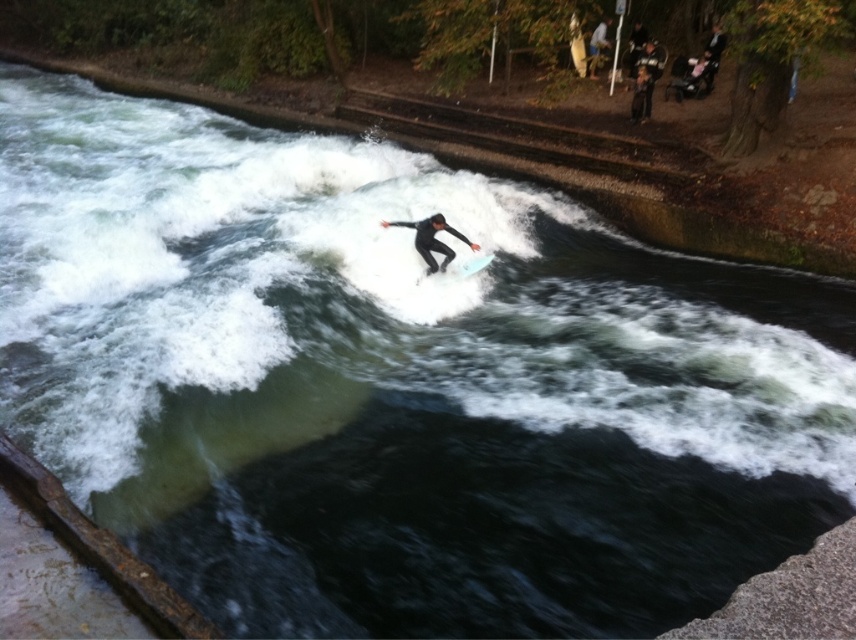
Can you confirm if black wetsuit surfer at center is wider than white foam surfboard at center?

Indeed, black wetsuit surfer at center has a greater width compared to white foam surfboard at center.

Is point (438, 216) farther from camera compared to point (485, 264)?

No, (438, 216) is closer to viewer.

Between point (437, 214) and point (480, 260), which one is positioned in front?

Point (437, 214)

Identify the location of black wetsuit surfer at center. This screenshot has width=856, height=640. (432, 240).

At what (x,y) coordinates should I click in order to perform the action: click on white foam surfboard at center. Please return your answer as a coordinate pair (x, y). Image resolution: width=856 pixels, height=640 pixels. Looking at the image, I should click on (474, 264).

Is white foam surfboard at center to the right of light blue smooth surfboard at center from the viewer's perspective?

In fact, white foam surfboard at center is to the left of light blue smooth surfboard at center.

Describe the element at coordinates (474, 264) in the screenshot. The width and height of the screenshot is (856, 640). I see `white foam surfboard at center` at that location.

Image resolution: width=856 pixels, height=640 pixels. I want to click on white foam surfboard at center, so click(474, 264).

Who is positioned more to the left, black wetsuit surfer at center or light blue smooth surfboard at center?

From the viewer's perspective, black wetsuit surfer at center appears more on the left side.

Which is behind, point (446, 224) or point (480, 257)?

The point (480, 257) is more distant.

Is point (417, 234) farther from viewer compared to point (477, 259)?

No, (417, 234) is in front of (477, 259).

I want to click on black wetsuit surfer at center, so click(x=432, y=240).